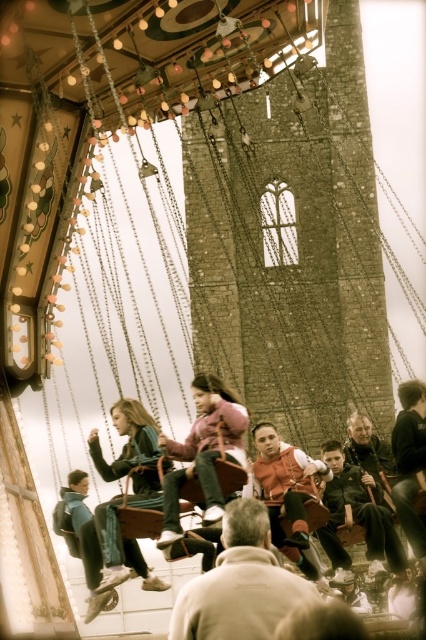
You are standing at the entrance of the fairground and see the pink fleece jacket at center and the orange fabric vest at center. Which one is closer to you?

The pink fleece jacket at center is 22.07 feet away from the orange fabric vest at center, so the orange fabric vest at center is closer to you since it is only 22.07 feet away from the jacket which is further away.

You are standing at the entrance of the amusement park and see the denim jeans at center and the orange fabric vest at center. Which one is nearer to you?

The denim jeans at center is closer to the viewer than the orange fabric vest at center, so the denim jeans at center is nearer to you.

You are observing a group of people on a swing ride at a fairground. You see a light brown leather jacket at center and a matte pink sweater at center. Which piece of clothing is located to the left of the other?

The light brown leather jacket at center is positioned on the left side of matte pink sweater at center.